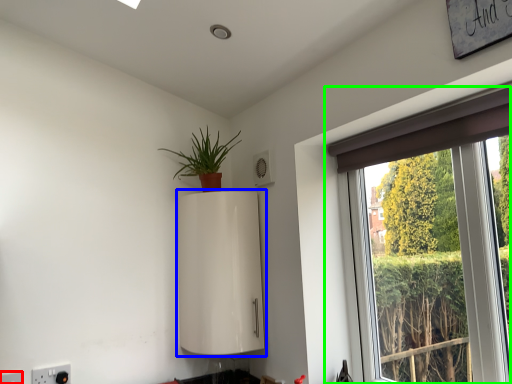
Question: Based on their relative distances, which object is farther from electric outlet (highlighted by a red box)? Choose from appliance (highlighted by a blue box) and window (highlighted by a green box).

Choices:
 (A) appliance
 (B) window

Answer: (B)